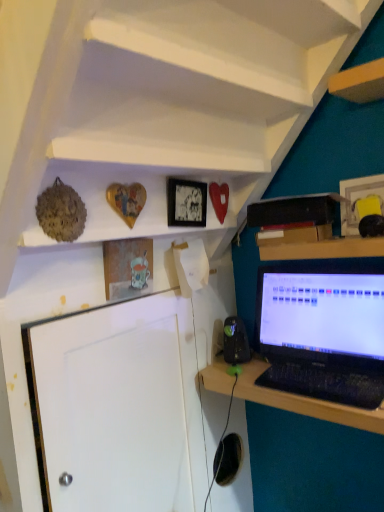
At what (x,y) coordinates should I click in order to perform the action: click on free spot above wooden desk at lower right (from a real-world perspective). Please return your answer as a coordinate pair (x, y). The height and width of the screenshot is (512, 384). Looking at the image, I should click on [x=283, y=380].